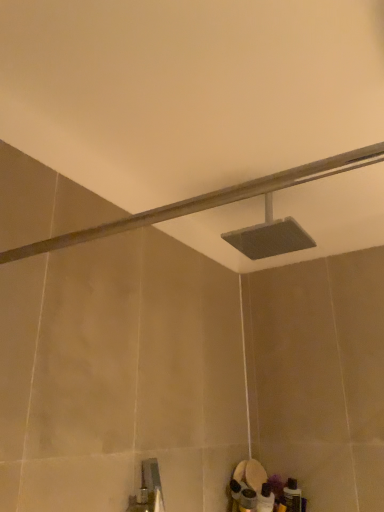
Question: Which direction should I rotate to look at matte gray showerhead at upper center, which is the second shower from back to front?

Choices:
 (A) right
 (B) left

Answer: (B)

Question: Considering the relative sizes of matte gray showerhead at center, the 2th shower when ordered from front to back, and matte gray showerhead at upper center, which is the second shower from back to front, in the image provided, is matte gray showerhead at center, the 2th shower when ordered from front to back, bigger than matte gray showerhead at upper center, which is the second shower from back to front,?

Choices:
 (A) yes
 (B) no

Answer: (A)

Question: From the image's perspective, is matte gray showerhead at center, the 2th shower when ordered from front to back, under matte gray showerhead at upper center, the 1th shower viewed from the front?

Choices:
 (A) yes
 (B) no

Answer: (B)

Question: Does matte gray showerhead at center, the 2th shower when ordered from front to back, have a lesser height compared to matte gray showerhead at upper center, which is the second shower from back to front?

Choices:
 (A) no
 (B) yes

Answer: (A)

Question: From the image's perspective, is matte gray showerhead at center, the 2th shower when ordered from front to back, above matte gray showerhead at upper center, which is the second shower from back to front?

Choices:
 (A) no
 (B) yes

Answer: (B)

Question: Is matte gray showerhead at center, which is the first shower from back to front, next to matte gray showerhead at upper center, the 1th shower viewed from the front, and touching it?

Choices:
 (A) yes
 (B) no

Answer: (B)

Question: Is matte gray showerhead at center, the 2th shower when ordered from front to back, taller than matte gray showerhead at upper center, which is the second shower from back to front?

Choices:
 (A) yes
 (B) no

Answer: (A)

Question: From a real-world perspective, is matte gray showerhead at upper center, the 1th shower viewed from the front, positioned under matte gray showerhead at center, the 2th shower when ordered from front to back, based on gravity?

Choices:
 (A) yes
 (B) no

Answer: (A)

Question: Is matte gray showerhead at center, the 2th shower when ordered from front to back, a part of matte gray showerhead at upper center, the 1th shower viewed from the front?

Choices:
 (A) no
 (B) yes

Answer: (A)

Question: Considering the relative positions of matte gray showerhead at upper center, which is the second shower from back to front, and matte gray showerhead at center, the 2th shower when ordered from front to back, in the image provided, is matte gray showerhead at upper center, which is the second shower from back to front, to the right of matte gray showerhead at center, the 2th shower when ordered from front to back, from the viewer's perspective?

Choices:
 (A) no
 (B) yes

Answer: (A)

Question: Can you confirm if matte gray showerhead at upper center, the 1th shower viewed from the front, is thinner than matte gray showerhead at center, the 2th shower when ordered from front to back?

Choices:
 (A) no
 (B) yes

Answer: (A)

Question: Can you confirm if matte gray showerhead at upper center, the 1th shower viewed from the front, is taller than matte gray showerhead at center, the 2th shower when ordered from front to back?

Choices:
 (A) yes
 (B) no

Answer: (B)

Question: Is matte gray showerhead at upper center, which is the second shower from back to front, to the left of matte gray showerhead at center, which is the first shower from back to front, from the viewer's perspective?

Choices:
 (A) yes
 (B) no

Answer: (A)

Question: From a real-world perspective, is matte gray showerhead at upper center, the 1th shower viewed from the front, positioned above or below matte gray showerhead at center, the 2th shower when ordered from front to back?

Choices:
 (A) above
 (B) below

Answer: (B)